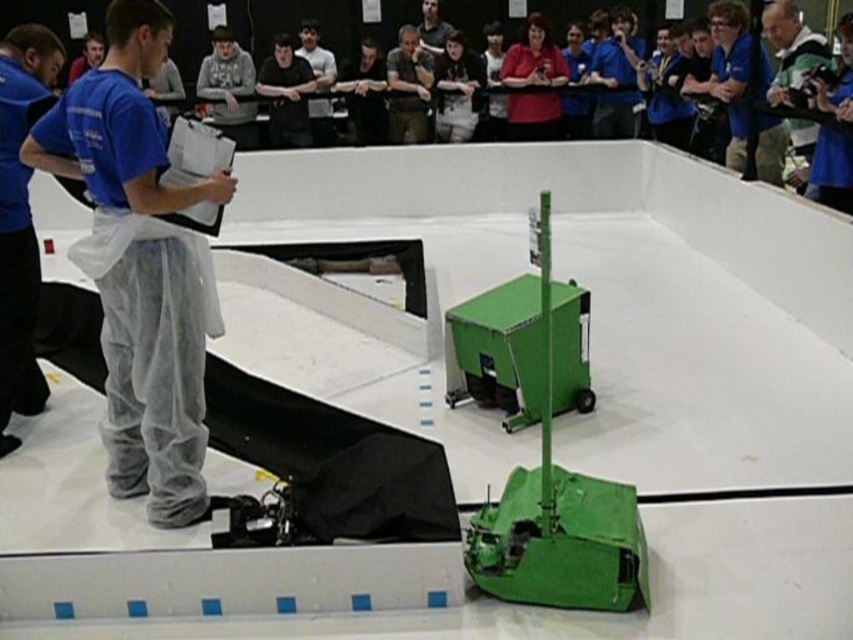
Can you confirm if gray sweatshirt at upper center is shorter than matte brown shirt at center?

Yes, gray sweatshirt at upper center is shorter than matte brown shirt at center.

Is gray sweatshirt at upper center taller than matte brown shirt at center?

No, gray sweatshirt at upper center is not taller than matte brown shirt at center.

Which is behind, point (215, 120) or point (393, 106)?

The point (215, 120) is behind.

The image size is (853, 640). Find the location of `gray sweatshirt at upper center`. gray sweatshirt at upper center is located at coordinates (229, 88).

What do you see at coordinates (532, 83) in the screenshot?
I see `matte red shirt at upper center` at bounding box center [532, 83].

Can you confirm if matte red shirt at upper center is shorter than matte brown shirt at center?

Yes, matte red shirt at upper center is shorter than matte brown shirt at center.

Who is more distant from viewer, (525, 131) or (392, 61)?

Positioned behind is point (392, 61).

The image size is (853, 640). In order to click on matte red shirt at upper center in this screenshot , I will do `click(532, 83)`.

Can you confirm if gray sweatshirt at upper center is bigger than black cotton shirt at center?

Indeed, gray sweatshirt at upper center has a larger size compared to black cotton shirt at center.

Who is taller, gray sweatshirt at upper center or black cotton shirt at center?

gray sweatshirt at upper center

Which is in front, point (241, 138) or point (294, 112)?

Positioned in front is point (241, 138).

This screenshot has width=853, height=640. I want to click on gray sweatshirt at upper center, so click(229, 88).